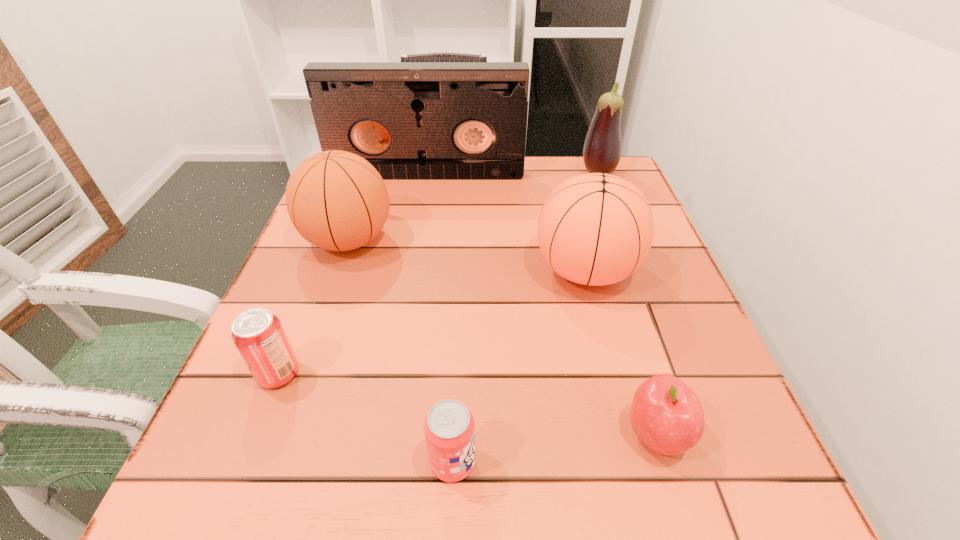
In order to click on basketball situated at the left edge in this screenshot , I will do `click(336, 200)`.

Where is `soda present at the left edge`? soda present at the left edge is located at coordinates (258, 335).

This screenshot has height=540, width=960. Find the location of `eggplant situated at the right edge`. eggplant situated at the right edge is located at coordinates (602, 148).

Identify the location of basketball situated at the right edge. pos(595,229).

Where is `apple that is at the right edge`? apple that is at the right edge is located at coordinates (666, 415).

The image size is (960, 540). Find the location of `object situated at the far left corner`. object situated at the far left corner is located at coordinates (410, 120).

I want to click on object at the far right corner, so click(602, 148).

The image size is (960, 540). What are the coordinates of `object located in the near right corner section of the desktop` in the screenshot? It's located at (666, 415).

What are the coordinates of `free region at the far edge` in the screenshot? It's located at (525, 161).

The image size is (960, 540). In order to click on vacant space at the near edge in this screenshot , I will do `click(411, 519)`.